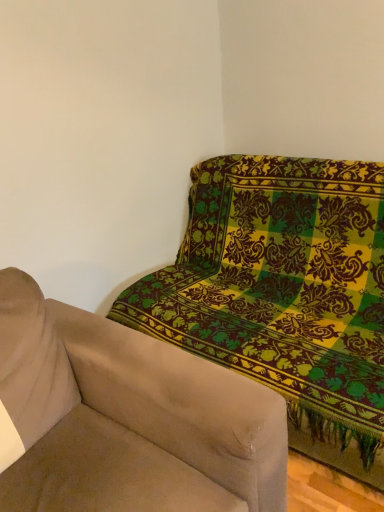
Describe the element at coordinates (128, 418) in the screenshot. The width and height of the screenshot is (384, 512). I see `beige fabric couch at upper right` at that location.

Where is `beige fabric couch at upper right`? beige fabric couch at upper right is located at coordinates (128, 418).

Measure the distance between point (248, 285) and camera.

The depth of point (248, 285) is 2.01 meters.

The height and width of the screenshot is (512, 384). In order to click on green patterned fabric sofa at upper right in this screenshot , I will do `click(284, 295)`.

What do you see at coordinates (284, 295) in the screenshot?
I see `green patterned fabric sofa at upper right` at bounding box center [284, 295].

At what (x,y) coordinates should I click in order to perform the action: click on beige fabric couch at upper right. Please return your answer as a coordinate pair (x, y). The height and width of the screenshot is (512, 384). Looking at the image, I should click on (128, 418).

Can you confirm if beige fabric couch at upper right is positioned to the left of green patterned fabric sofa at upper right?

Correct, you'll find beige fabric couch at upper right to the left of green patterned fabric sofa at upper right.

Relative to green patterned fabric sofa at upper right, is beige fabric couch at upper right in front or behind?

In the image, beige fabric couch at upper right appears in front of green patterned fabric sofa at upper right.

Which point is more forward, (46, 447) or (369, 411)?

The point (46, 447) is more forward.

From the image's perspective, is beige fabric couch at upper right above green patterned fabric sofa at upper right?

Actually, beige fabric couch at upper right appears below green patterned fabric sofa at upper right in the image.

From a real-world perspective, is beige fabric couch at upper right beneath green patterned fabric sofa at upper right?

No.

Looking at their sizes, would you say beige fabric couch at upper right is wider or thinner than green patterned fabric sofa at upper right?

Clearly, beige fabric couch at upper right has less width compared to green patterned fabric sofa at upper right.

Considering the sizes of objects beige fabric couch at upper right and green patterned fabric sofa at upper right in the image provided, who is taller, beige fabric couch at upper right or green patterned fabric sofa at upper right?

Standing taller between the two is green patterned fabric sofa at upper right.

Which of these two, beige fabric couch at upper right or green patterned fabric sofa at upper right, is bigger?

green patterned fabric sofa at upper right is bigger.

Is beige fabric couch at upper right inside the boundaries of green patterned fabric sofa at upper right, or outside?

beige fabric couch at upper right is not inside green patterned fabric sofa at upper right, it's outside.

Is beige fabric couch at upper right not close to green patterned fabric sofa at upper right?

beige fabric couch at upper right is near green patterned fabric sofa at upper right, not far away.

Is green patterned fabric sofa at upper right at the back of beige fabric couch at upper right?

No, beige fabric couch at upper right is not facing away from green patterned fabric sofa at upper right.

In order to click on studio couch above the green patterned fabric sofa at upper right (from a real-world perspective) in this screenshot , I will do `click(128, 418)`.

Based on the photo, can you confirm if green patterned fabric sofa at upper right is positioned to the left of beige fabric couch at upper right?

No, green patterned fabric sofa at upper right is not to the left of beige fabric couch at upper right.

Is green patterned fabric sofa at upper right closer to the viewer compared to beige fabric couch at upper right?

No, green patterned fabric sofa at upper right is further to the viewer.

Considering the positions of points (235, 322) and (46, 485), is point (235, 322) farther from camera compared to point (46, 485)?

That is True.

From the image's perspective, which is above, green patterned fabric sofa at upper right or beige fabric couch at upper right?

green patterned fabric sofa at upper right appears higher in the image.

From a real-world perspective, is green patterned fabric sofa at upper right physically located above or below beige fabric couch at upper right?

From a real-world perspective, green patterned fabric sofa at upper right is physically below beige fabric couch at upper right.

Between green patterned fabric sofa at upper right and beige fabric couch at upper right, which one has larger width?

Wider between the two is green patterned fabric sofa at upper right.

Who is shorter, green patterned fabric sofa at upper right or beige fabric couch at upper right?

beige fabric couch at upper right is shorter.

Is green patterned fabric sofa at upper right smaller than beige fabric couch at upper right?

Incorrect, green patterned fabric sofa at upper right is not smaller in size than beige fabric couch at upper right.

Would you say beige fabric couch at upper right is part of green patterned fabric sofa at upper right's contents?

No.

Are green patterned fabric sofa at upper right and beige fabric couch at upper right far apart?

green patterned fabric sofa at upper right is near beige fabric couch at upper right, not far away.

Is green patterned fabric sofa at upper right aimed at beige fabric couch at upper right?

Yes, green patterned fabric sofa at upper right is turned towards beige fabric couch at upper right.

Can you tell me how much green patterned fabric sofa at upper right and beige fabric couch at upper right differ in facing direction?

green patterned fabric sofa at upper right and beige fabric couch at upper right are facing 90 degrees away from each other.

Identify the location of studio sofa behind the beige fabric couch at upper right. (284, 295).

The image size is (384, 512). I want to click on studio couch above the green patterned fabric sofa at upper right (from a real-world perspective), so click(x=128, y=418).

Locate an element on the screen. This screenshot has height=512, width=384. studio couch that appears below the green patterned fabric sofa at upper right (from the image's perspective) is located at coordinates (128, 418).